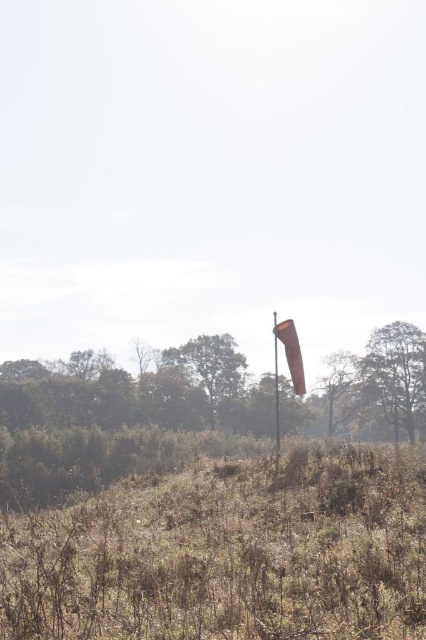
Where is `green leafy tree at center`? This screenshot has height=640, width=426. green leafy tree at center is located at coordinates (210, 365).

Which is in front, point (210, 422) or point (275, 460)?

Point (275, 460) is in front.

Where is `green leafy tree at center`? The height and width of the screenshot is (640, 426). green leafy tree at center is located at coordinates (210, 365).

Which of these two, brown textured tree at right or smooth orange flag pole at center, stands taller?

With more height is brown textured tree at right.

Measure the distance between brown textured tree at right and camera.

A distance of 201.52 feet exists between brown textured tree at right and camera.

You are a GUI agent. You are given a task and a screenshot of the screen. Output one action in this format:
    pyautogui.click(x=<x>, y=<y>)
    Task: Click on the brown textured tree at right
    The image size is (426, 640).
    Given the screenshot: What is the action you would take?
    pyautogui.click(x=396, y=372)

Is brown textured tree at right wider than green leafy tree at center?

No, brown textured tree at right is not wider than green leafy tree at center.

Which is behind, point (397, 388) or point (189, 365)?

Point (189, 365)

Image resolution: width=426 pixels, height=640 pixels. I want to click on brown textured tree at right, so click(x=396, y=372).